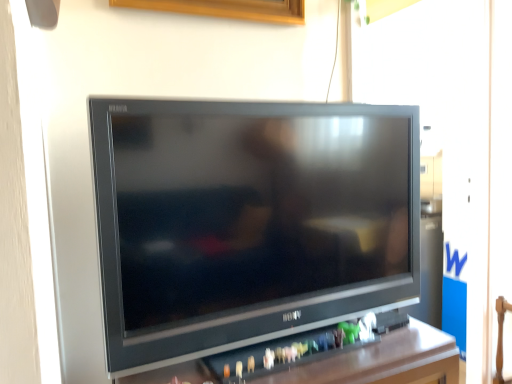
At what (x,y) coordinates should I click in order to perform the action: click on satin black television at center. Please return your answer as a coordinate pair (x, y). Image resolution: width=512 pixels, height=384 pixels. Looking at the image, I should click on (249, 221).

This screenshot has width=512, height=384. What do you see at coordinates (249, 221) in the screenshot? I see `satin black television at center` at bounding box center [249, 221].

In order to face black plastic tv at center, should I rotate leftwards or rightwards?

To align with it, rotate right about 3.688°.

This screenshot has width=512, height=384. Describe the element at coordinates (384, 361) in the screenshot. I see `black plastic tv at center` at that location.

Where is `black plastic tv at center`? black plastic tv at center is located at coordinates (384, 361).

Image resolution: width=512 pixels, height=384 pixels. Find the location of `satin black television at center`. satin black television at center is located at coordinates (249, 221).

Is black plastic tv at center to the left of satin black television at center from the viewer's perspective?

Correct, you'll find black plastic tv at center to the left of satin black television at center.

Is black plastic tv at center in front of or behind satin black television at center in the image?

black plastic tv at center is positioned closer to the viewer than satin black television at center.

Between point (432, 336) and point (402, 158), which one is positioned behind?

The point (402, 158) is farther from the camera.

From the image's perspective, which object appears higher, black plastic tv at center or satin black television at center?

satin black television at center.

From a real-world perspective, relative to satin black television at center, is black plastic tv at center vertically above or below?

black plastic tv at center is below satin black television at center.

Considering the sizes of objects black plastic tv at center and satin black television at center in the image provided, who is wider, black plastic tv at center or satin black television at center?

Wider between the two is black plastic tv at center.

Between black plastic tv at center and satin black television at center, which one has less height?

With less height is black plastic tv at center.

Can you confirm if black plastic tv at center is bigger than satin black television at center?

Indeed, black plastic tv at center has a larger size compared to satin black television at center.

Is black plastic tv at center located outside satin black television at center?

Absolutely, black plastic tv at center is external to satin black television at center.

Does black plastic tv at center touch satin black television at center?

black plastic tv at center is not next to satin black television at center, and they're not touching.

From the picture: Is black plastic tv at center facing towards satin black television at center?

No.

How much distance is there between black plastic tv at center and satin black television at center?

black plastic tv at center is 31.72 centimeters away from satin black television at center.

Locate an element on the screen. The width and height of the screenshot is (512, 384). furniture below the satin black television at center (from the image's perspective) is located at coordinates (384, 361).

Considering the relative positions of satin black television at center and black plastic tv at center in the image provided, is satin black television at center to the right of black plastic tv at center from the viewer's perspective?

Correct, you'll find satin black television at center to the right of black plastic tv at center.

Does satin black television at center come behind black plastic tv at center?

Yes, satin black television at center is further from the camera.

Which is closer to the camera, (334, 184) or (450, 342)?

The point (334, 184) is in front.

From the image's perspective, between satin black television at center and black plastic tv at center, which one is located above?

satin black television at center.

From a real-world perspective, does satin black television at center stand above black plastic tv at center?

Indeed, from a real-world perspective, satin black television at center stands above black plastic tv at center.

Considering the relative sizes of satin black television at center and black plastic tv at center in the image provided, is satin black television at center thinner than black plastic tv at center?

Yes.

Can you confirm if satin black television at center is shorter than black plastic tv at center?

Incorrect, the height of satin black television at center does not fall short of that of black plastic tv at center.

Considering the sizes of satin black television at center and black plastic tv at center in the image, is satin black television at center bigger or smaller than black plastic tv at center?

Considering their sizes, satin black television at center takes up less space than black plastic tv at center.

From the picture: Is black plastic tv at center completely or partially inside satin black television at center?

Actually, black plastic tv at center is outside satin black television at center.

Is satin black television at center beside black plastic tv at center?

satin black television at center and black plastic tv at center are not in contact.

Is satin black television at center aimed at black plastic tv at center?

No, satin black television at center does not turn towards black plastic tv at center.

How many degrees apart are the facing directions of satin black television at center and black plastic tv at center?

The facing directions of satin black television at center and black plastic tv at center are 1.11 degrees apart.

The height and width of the screenshot is (384, 512). Identify the location of furniture beneath the satin black television at center (from a real-world perspective). (384, 361).

Locate an element on the screen. television behind the black plastic tv at center is located at coordinates (249, 221).

This screenshot has height=384, width=512. Find the location of `furniture below the satin black television at center (from the image's perspective)`. furniture below the satin black television at center (from the image's perspective) is located at coordinates (384, 361).